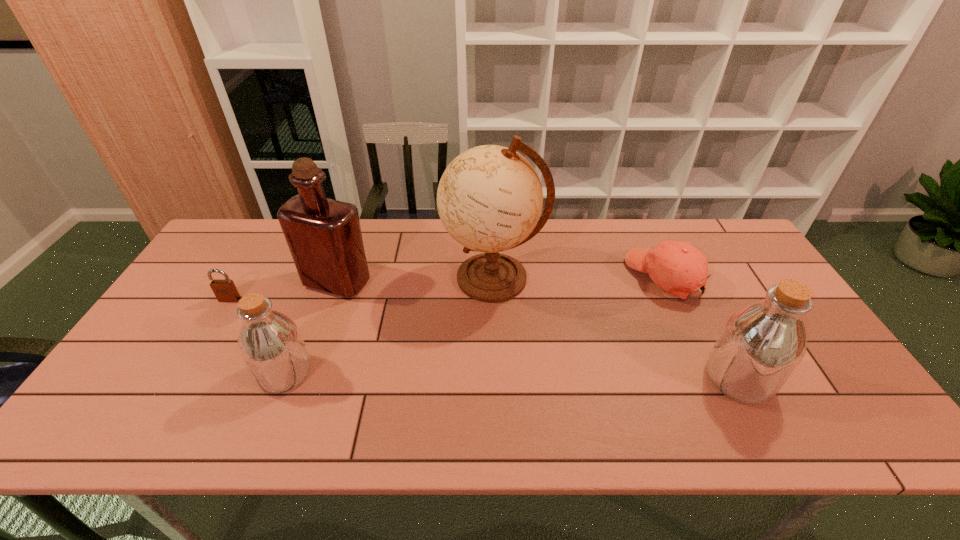
This screenshot has width=960, height=540. I want to click on free space located on the right of the right bottle, so click(825, 379).

The height and width of the screenshot is (540, 960). What are the coordinates of `free space located 0.230m on the surface of the third object from right to left` in the screenshot? It's located at (367, 278).

The image size is (960, 540). Find the location of `free space located 0.280m on the surface of the third object from right to left`. free space located 0.280m on the surface of the third object from right to left is located at coordinates (350, 278).

Identify the location of free location located 0.350m on the surface of the third object from right to left. The height and width of the screenshot is (540, 960). (327, 278).

The height and width of the screenshot is (540, 960). I want to click on blank space located 0.140m on the front of the liquor, so click(317, 339).

Locate an element on the screen. vacant space situated on the front-facing side of the padlock is located at coordinates (184, 374).

In order to click on vacant space located 0.290m on the left of the baseball cap in this screenshot , I will do `click(535, 278)`.

You are a GUI agent. You are given a task and a screenshot of the screen. Output one action in this format:
    pyautogui.click(x=<x>, y=<y>)
    Task: Click on the globe located at the far edge
    The width and height of the screenshot is (960, 540).
    Given the screenshot: What is the action you would take?
    pyautogui.click(x=489, y=199)

Identify the location of baseball cap located at the far edge. This screenshot has width=960, height=540. (679, 268).

Where is `object located at the left edge`? object located at the left edge is located at coordinates (225, 290).